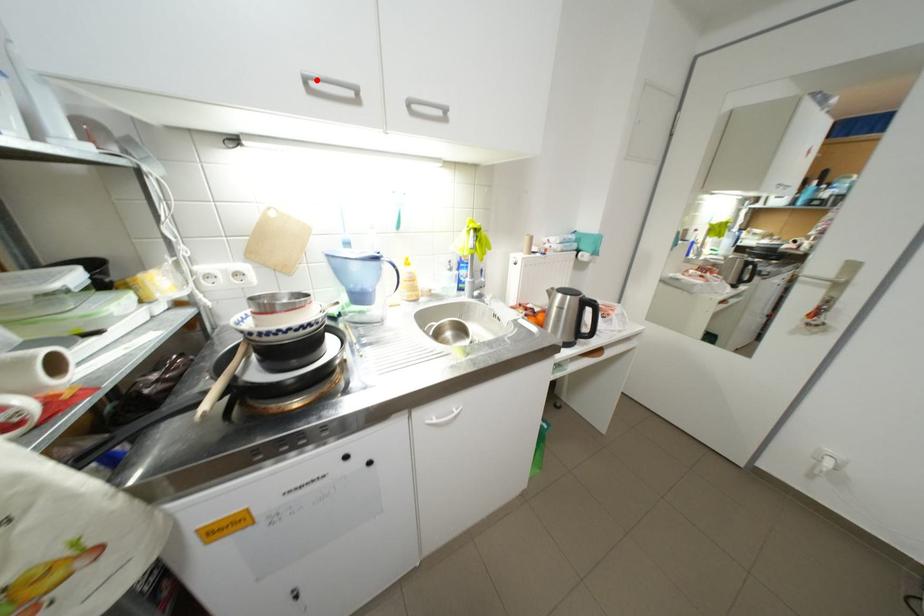
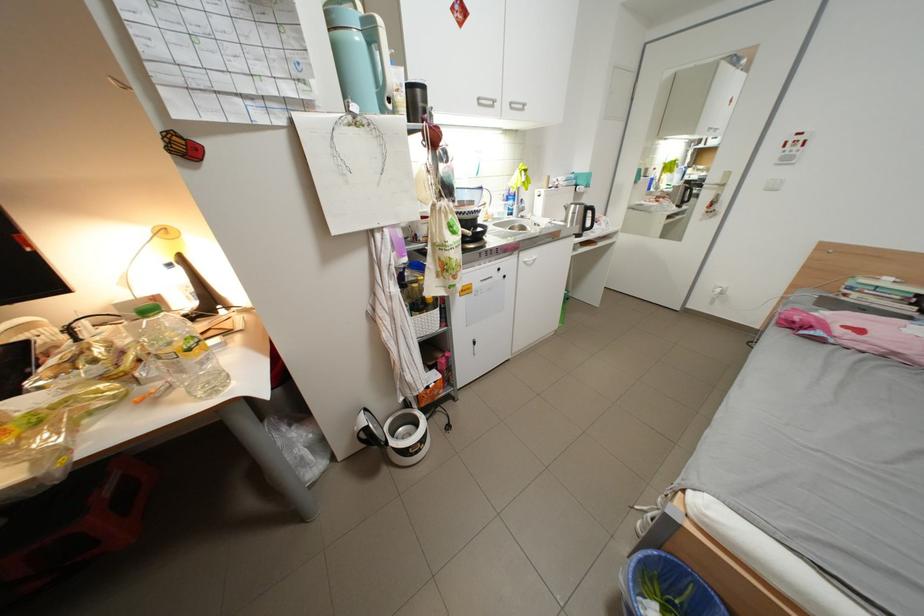
In the second image, find the point that corresponds to the highlighted location in the first image.

(490, 100)